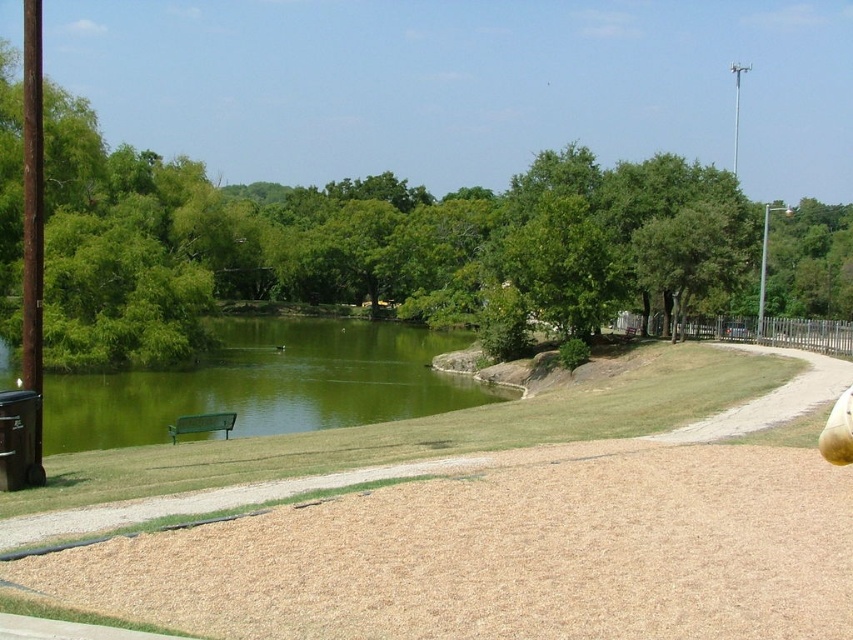
Looking at this image, who is more forward, (x=318, y=625) or (x=68, y=413)?

Point (x=318, y=625) is in front.

Consider the image. Does brown wood chips at lower center appear under green liquid water at lower left?

Yes, brown wood chips at lower center is below green liquid water at lower left.

Who is more distant from viewer, (640, 618) or (119, 400)?

The point (119, 400) is behind.

The image size is (853, 640). I want to click on brown wood chips at lower center, so click(508, 556).

Does brown wood chips at lower center have a lesser width compared to green matte bench at lower left?

Yes.

Who is shorter, brown wood chips at lower center or green matte bench at lower left?

Standing shorter between the two is brown wood chips at lower center.

Is point (364, 561) positioned in front of point (177, 433)?

That is True.

Locate an element on the screen. Image resolution: width=853 pixels, height=640 pixels. brown wood chips at lower center is located at coordinates (508, 556).

Does green liquid water at lower left have a lesser height compared to green matte bench at lower left?

No.

Describe the element at coordinates (268, 384) in the screenshot. I see `green liquid water at lower left` at that location.

Image resolution: width=853 pixels, height=640 pixels. Identify the location of green liquid water at lower left. (268, 384).